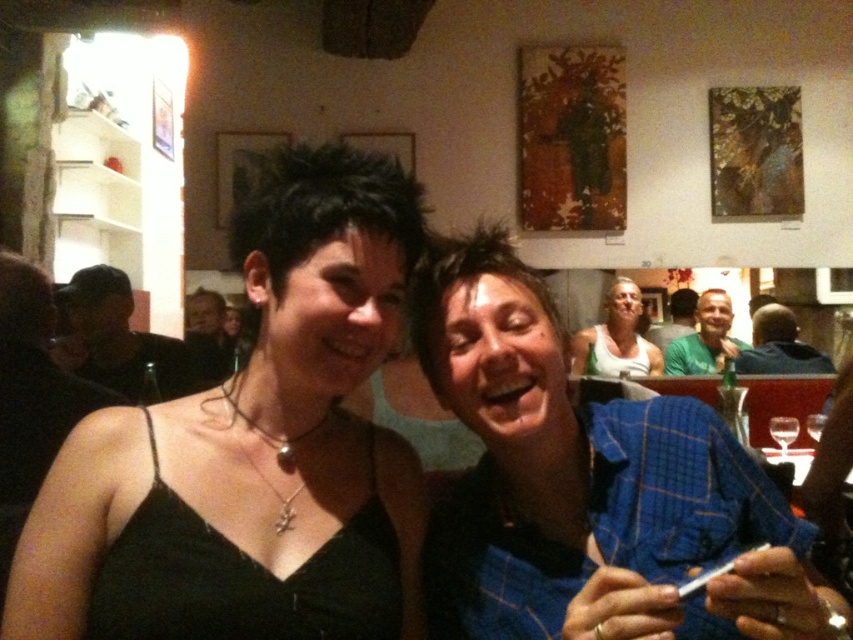
Between dark brown leather jacket at left and transparent glass at center, which one appears on the right side from the viewer's perspective?

From the viewer's perspective, transparent glass at center appears more on the right side.

Is point (157, 355) positioned behind point (784, 449)?

Yes.

I want to click on dark brown leather jacket at left, so pyautogui.click(x=120, y=339).

Is black satin dress at center positioned at the back of green shirt at center?

That is False.

Does black satin dress at center have a greater height compared to green shirt at center?

Yes, black satin dress at center is taller than green shirt at center.

What do you see at coordinates (253, 449) in the screenshot? This screenshot has width=853, height=640. I see `black satin dress at center` at bounding box center [253, 449].

This screenshot has width=853, height=640. Identify the location of black satin dress at center. (253, 449).

How far apart are black fabric shirt at left and green shirt at center?

black fabric shirt at left and green shirt at center are 7.71 feet apart from each other.

Which is more to the left, black fabric shirt at left or green shirt at center?

From the viewer's perspective, black fabric shirt at left appears more on the left side.

At what (x,y) coordinates should I click in order to perform the action: click on black fabric shirt at left. Please return your answer as a coordinate pair (x, y). The image size is (853, 640). Looking at the image, I should click on (32, 397).